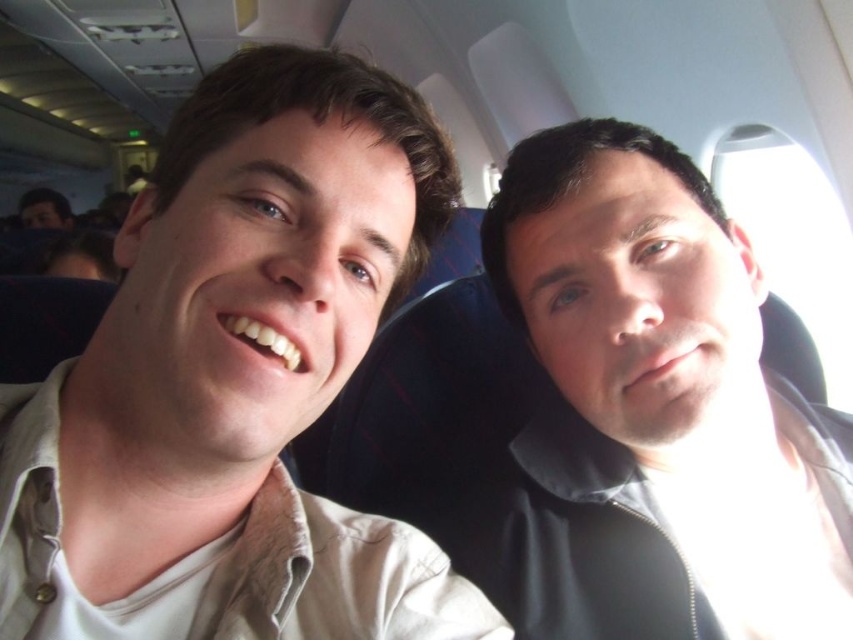
You are a passenger sitting in the airplane cabin. You notice a point marked at coordinates point (x=705, y=205). If you want to reach that point with your hand, can you do it without moving from your seat?

The point (x=705, y=205) is 24.77 inches away from viewer. Since the average human arm length is about 25 inches, you might just barely reach it by stretching your arm out fully.